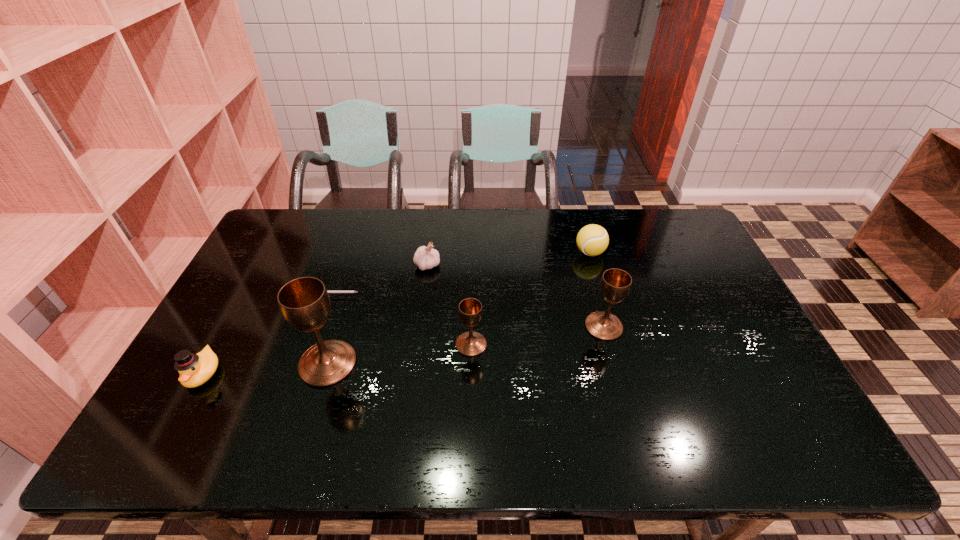
This screenshot has width=960, height=540. In order to click on duck in this screenshot , I will do pyautogui.click(x=195, y=369).

Locate an element on the screen. This screenshot has height=540, width=960. vacant point located on the back of the leftmost chalice is located at coordinates (350, 290).

I want to click on vacant space located 0.180m on the back of the second chalice from left to right, so [x=472, y=287].

At what (x,y) coordinates should I click in order to perform the action: click on vacant space located 0.120m on the right of the rightmost chalice. Please return your answer as a coordinate pair (x, y). Looking at the image, I should click on (664, 327).

At what (x,y) coordinates should I click in order to perform the action: click on vacant space located at the tip of the fifth nearest object. Please return your answer as a coordinate pair (x, y). This screenshot has height=540, width=960. Looking at the image, I should click on (429, 296).

Identify the location of vacant space located 0.140m on the front of the garlic. This screenshot has height=540, width=960. (422, 306).

Identify the location of vacant area located 0.320m on the left of the tennis ball. The width and height of the screenshot is (960, 540). (479, 252).

In order to click on object at the far edge in this screenshot , I will do `click(592, 240)`.

This screenshot has height=540, width=960. What are the coordinates of `chalice that is at the near edge` in the screenshot? It's located at (304, 302).

You are a GUI agent. You are given a task and a screenshot of the screen. Output one action in this format:
    pyautogui.click(x=<x>, y=<y>)
    Task: Click on the duck that is at the near edge
    The height and width of the screenshot is (540, 960).
    Given the screenshot: What is the action you would take?
    pyautogui.click(x=195, y=369)